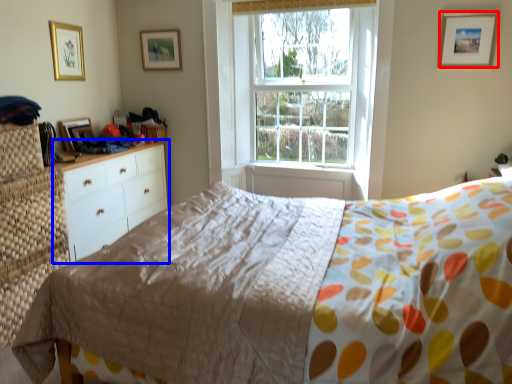
Question: Among these objects, which one is nearest to the camera, picture frame (highlighted by a red box) or chest of drawers (highlighted by a blue box)?

Choices:
 (A) picture frame
 (B) chest of drawers

Answer: (B)